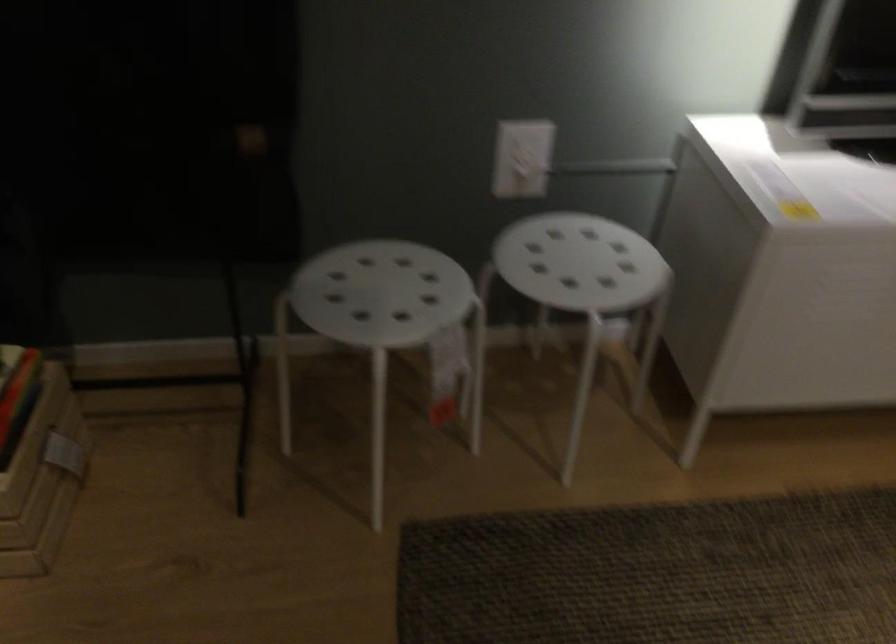
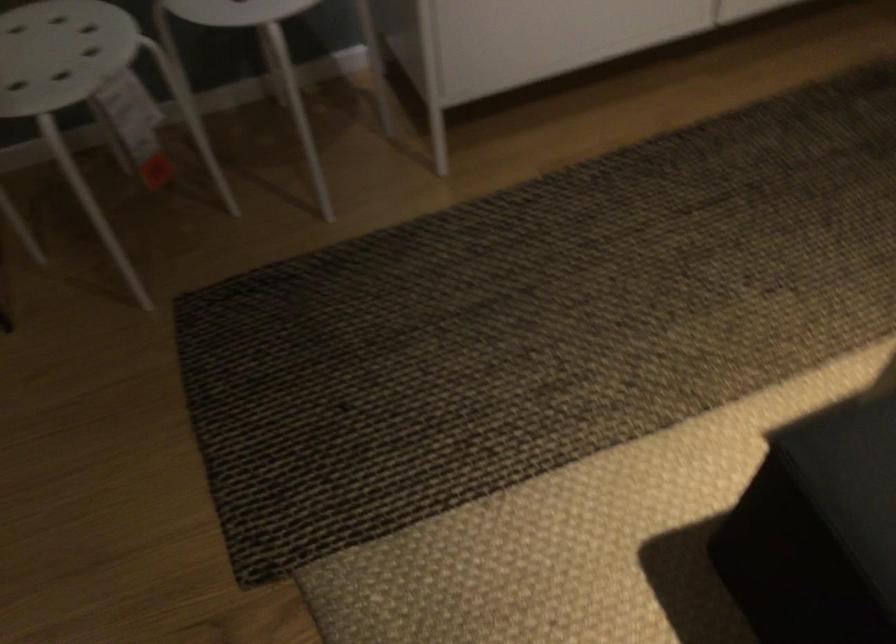
The point at (397, 289) is marked in the first image. Where is the corresponding point in the second image?

(61, 53)